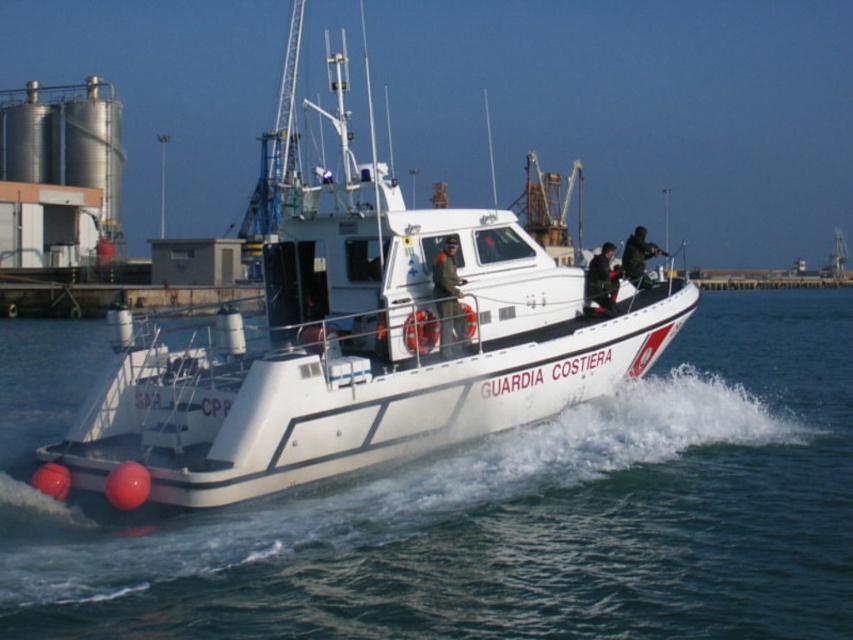
You are standing on the deck of the Guardia Costiera boat and want to take a photo of the point at coordinates [752,561]. The camera you have can focus on objects up to 40 feet away. Will the camera be able to focus on the point?

The point at coordinates [752,561] is 38.56 feet away from the camera, which is within the camera maximum focusing distance of 40 feet. Therefore, the camera will be able to focus on the point.

Consider the image. You are a photographer trying to capture the Guardia Costiera boat in the image. Which object takes up more space in the photo, the white water at center or the white matte boat at center?

Result: The white matte boat at center occupies more space than the white water at center in the photo.